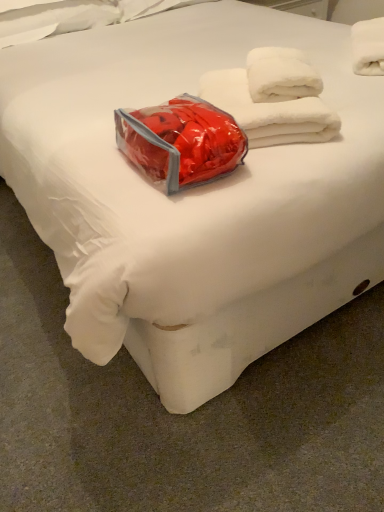
Question: Is white fluffy towel at upper right, positioned as the first towel in top-to-bottom order, positioned before white fluffy towels at upper right, marked as the second towel in a top-to-bottom arrangement?

Choices:
 (A) no
 (B) yes

Answer: (A)

Question: Is white fluffy towel at upper right, arranged as the 2th towel when viewed from the left, turned away from white fluffy towels at upper right, which is the 2th towel from right to left?

Choices:
 (A) no
 (B) yes

Answer: (A)

Question: Can white fluffy towels at upper right, which is the 2th towel from right to left, be found inside white fluffy towel at upper right, placed as the second towel when sorted from bottom to top?

Choices:
 (A) no
 (B) yes

Answer: (A)

Question: Can we say white fluffy towel at upper right, arranged as the 2th towel when viewed from the left, lies outside white fluffy towels at upper right, which is the 2th towel from right to left?

Choices:
 (A) yes
 (B) no

Answer: (A)

Question: From the image's perspective, is white fluffy towel at upper right, arranged as the 2th towel when viewed from the left, located above white fluffy towels at upper right, the first towel from the left?

Choices:
 (A) no
 (B) yes

Answer: (B)

Question: Is white fluffy towel at upper right, the first towel from the right, next to white fluffy towels at upper right, the first towel from the left, and touching it?

Choices:
 (A) yes
 (B) no

Answer: (B)

Question: Considering the relative sizes of white fluffy towels at upper right, marked as the second towel in a top-to-bottom arrangement, and white fluffy towel at upper right, placed as the second towel when sorted from bottom to top, in the image provided, is white fluffy towels at upper right, marked as the second towel in a top-to-bottom arrangement, shorter than white fluffy towel at upper right, placed as the second towel when sorted from bottom to top,?

Choices:
 (A) no
 (B) yes

Answer: (B)

Question: Is white fluffy towels at upper right, marked as the second towel in a top-to-bottom arrangement, completely or partially outside of white fluffy towel at upper right, positioned as the first towel in top-to-bottom order?

Choices:
 (A) yes
 (B) no

Answer: (A)

Question: Is white fluffy towels at upper right, which is counted as the 1th towel, starting from the bottom, at the left side of white fluffy towel at upper right, arranged as the 2th towel when viewed from the left?

Choices:
 (A) no
 (B) yes

Answer: (B)

Question: Is white fluffy towels at upper right, which is the 2th towel from right to left, not near white fluffy towel at upper right, arranged as the 2th towel when viewed from the left?

Choices:
 (A) no
 (B) yes

Answer: (A)

Question: Is white fluffy towels at upper right, the first towel from the left, positioned in front of white fluffy towel at upper right, placed as the second towel when sorted from bottom to top?

Choices:
 (A) no
 (B) yes

Answer: (B)

Question: From the image's perspective, is white fluffy towels at upper right, which is the 2th towel from right to left, under white fluffy towel at upper right, positioned as the first towel in top-to-bottom order?

Choices:
 (A) yes
 (B) no

Answer: (A)

Question: Considering the relative sizes of white fluffy towels at upper right, marked as the second towel in a top-to-bottom arrangement, and shiny plastic bag at center in the image provided, is white fluffy towels at upper right, marked as the second towel in a top-to-bottom arrangement, thinner than shiny plastic bag at center?

Choices:
 (A) no
 (B) yes

Answer: (A)